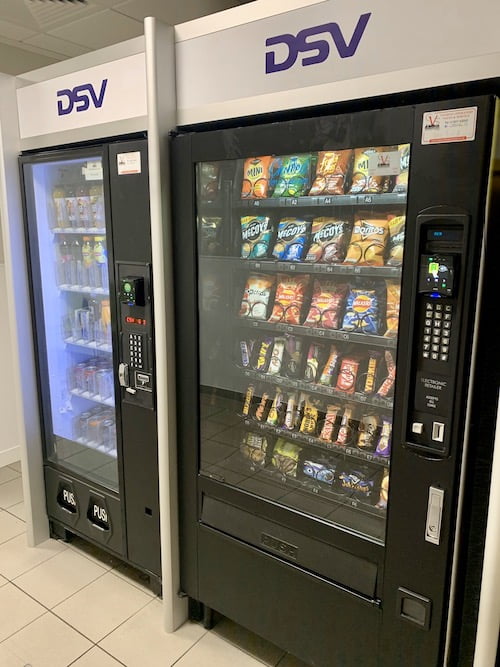
This screenshot has width=500, height=667. I want to click on ceiling, so click(95, 27).